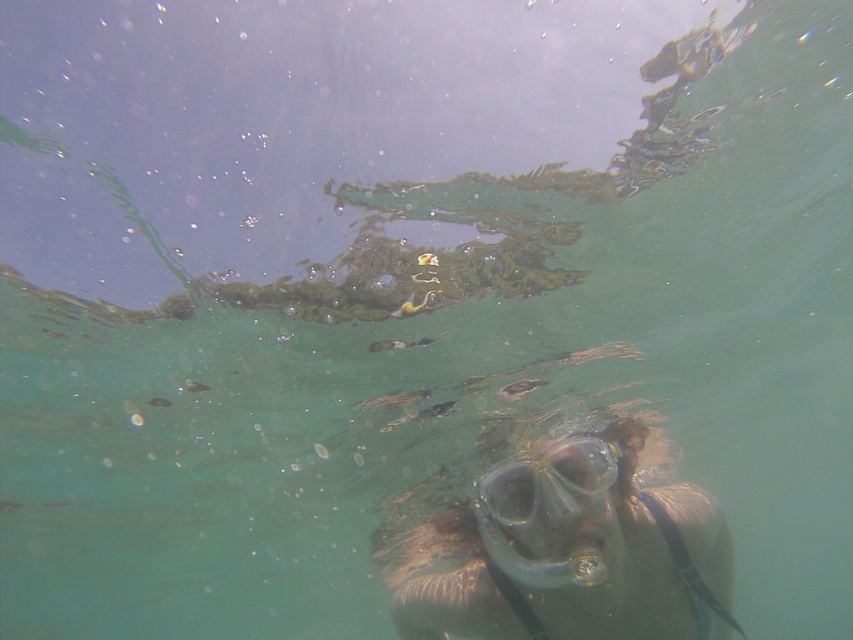
Is clear plastic mask at center to the left of transparent plastic goggles at center from the viewer's perspective?

Incorrect, clear plastic mask at center is not on the left side of transparent plastic goggles at center.

Describe the element at coordinates (567, 548) in the screenshot. I see `clear plastic mask at center` at that location.

The width and height of the screenshot is (853, 640). Find the location of `clear plastic mask at center`. clear plastic mask at center is located at coordinates (567, 548).